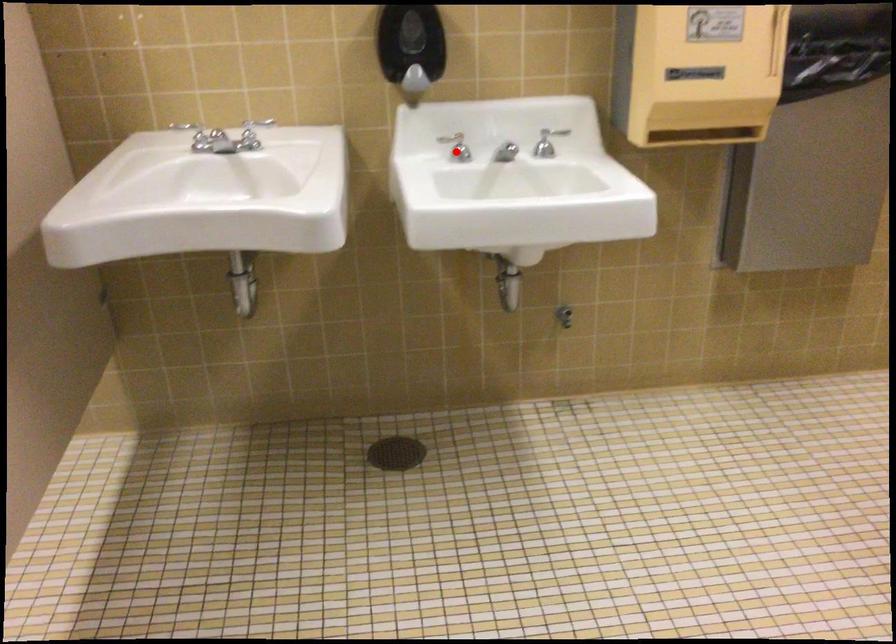
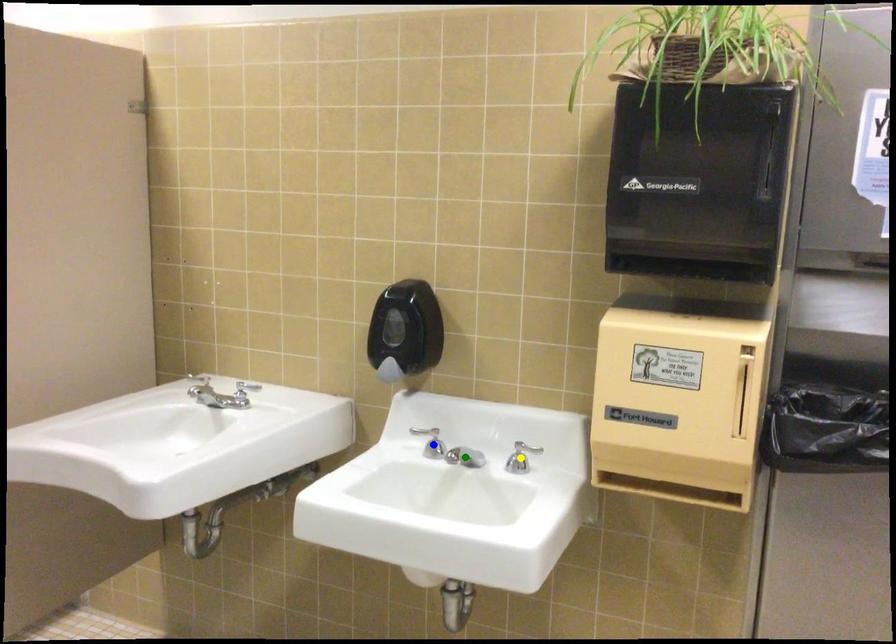
Question: I am providing you with two images of the same scene from different viewpoints. A red point is marked on the first image. You are given multiple points on the second image. Which point in image 2 is actually the same real-world point as the red point in image 1?

Choices:
 (A) blue point
 (B) green point
 (C) yellow point

Answer: (A)